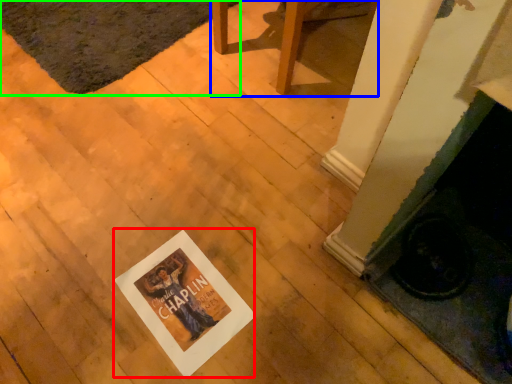
Question: Which object is positioned closest to postcard (highlighted by a red box)? Select from furniture (highlighted by a blue box) and mat (highlighted by a green box).

Choices:
 (A) furniture
 (B) mat

Answer: (A)